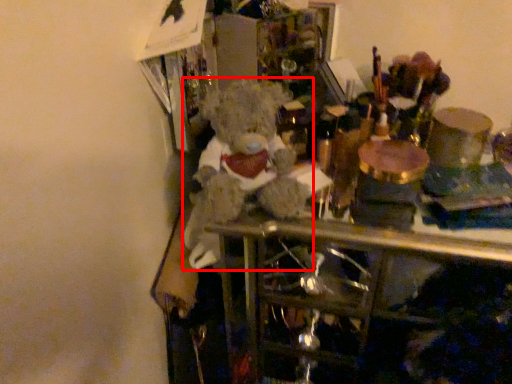
Question: From the image's perspective, considering the relative positions of teddy bear (annotated by the red box) and wine bottle in the image provided, where is teddy bear (annotated by the red box) located with respect to the staircase?

Choices:
 (A) below
 (B) above

Answer: (A)